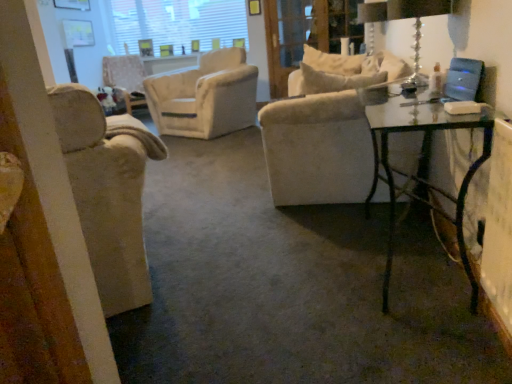
Question: From a real-world perspective, is velvet beige armchair at center, which ranks as the first chair in left-to-right order, above or below white textured window screen at upper center?

Choices:
 (A) below
 (B) above

Answer: (A)

Question: Which is correct: velvet beige armchair at center, marked as the first chair in a top-to-bottom arrangement, is inside white textured window screen at upper center, or outside of it?

Choices:
 (A) outside
 (B) inside

Answer: (A)

Question: Based on their relative distances, which object is farther from the white textured window screen at upper center?

Choices:
 (A) clear glass screen door at upper center
 (B) transparent glass table at right
 (C) beige fabric chair at left, marked as the first chair in a front-to-back arrangement
 (D) clear glass table lamp at upper right
 (E) velvet beige armchair at center, positioned as the 2th chair in front-to-back order

Answer: (C)

Question: Based on their relative distances, which object is farther from the transparent glass table at right?

Choices:
 (A) white textured window screen at upper center
 (B) clear glass table lamp at upper right
 (C) beige fabric chair at left, which appears as the second chair when viewed from the top
 (D) velvet beige armchair at center, which is the 2th chair in right-to-left order
 (E) clear glass screen door at upper center

Answer: (A)